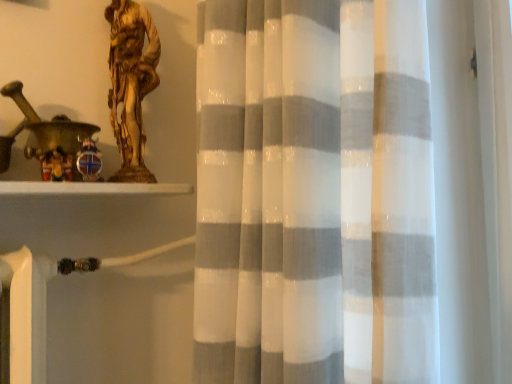
Question: Considering the relative positions of gold metallic statue at upper left and wooden figurine at left in the image provided, is gold metallic statue at upper left to the left of wooden figurine at left from the viewer's perspective?

Choices:
 (A) no
 (B) yes

Answer: (A)

Question: From a real-world perspective, is gold metallic statue at upper left physically below wooden figurine at left?

Choices:
 (A) yes
 (B) no

Answer: (B)

Question: Is gold metallic statue at upper left far from wooden figurine at left?

Choices:
 (A) yes
 (B) no

Answer: (B)

Question: Is gold metallic statue at upper left facing away from wooden figurine at left?

Choices:
 (A) no
 (B) yes

Answer: (A)

Question: Can you confirm if gold metallic statue at upper left is shorter than wooden figurine at left?

Choices:
 (A) no
 (B) yes

Answer: (A)

Question: Is gold metallic statue at upper left to the right of wooden figurine at left from the viewer's perspective?

Choices:
 (A) yes
 (B) no

Answer: (A)

Question: Is wooden figurine at left directly adjacent to gold metallic statue at upper left?

Choices:
 (A) yes
 (B) no

Answer: (B)

Question: Can you confirm if wooden figurine at left is positioned to the left of gold metallic statue at upper left?

Choices:
 (A) yes
 (B) no

Answer: (A)

Question: Can you confirm if wooden figurine at left is positioned to the right of gold metallic statue at upper left?

Choices:
 (A) yes
 (B) no

Answer: (B)

Question: Is wooden figurine at left bigger than gold metallic statue at upper left?

Choices:
 (A) yes
 (B) no

Answer: (B)

Question: From the image's perspective, is wooden figurine at left on top of gold metallic statue at upper left?

Choices:
 (A) no
 (B) yes

Answer: (A)

Question: Is wooden figurine at left oriented towards gold metallic statue at upper left?

Choices:
 (A) yes
 (B) no

Answer: (B)

Question: Visually, is wooden figurine at left positioned to the left or to the right of gold metallic statue at upper left?

Choices:
 (A) right
 (B) left

Answer: (B)